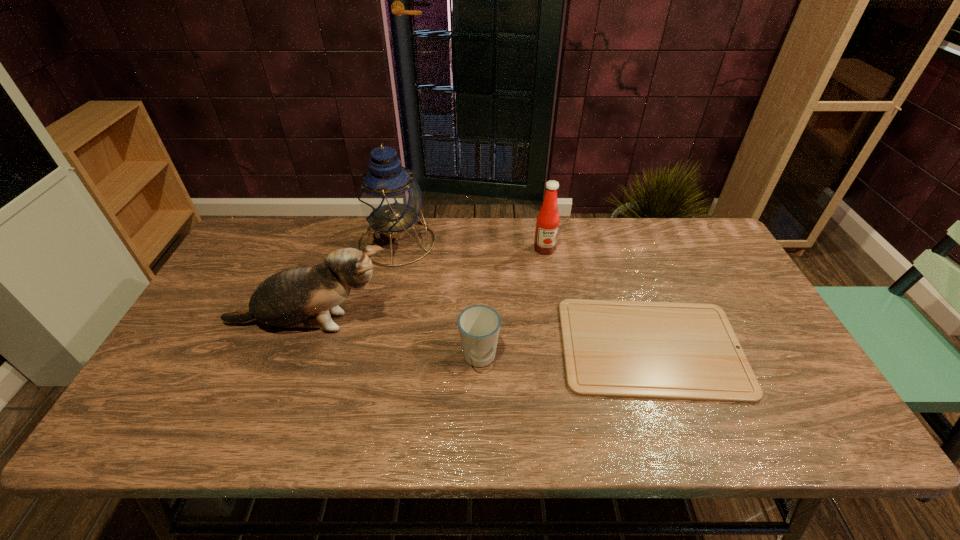
Where is `blank space that satisfies the following two spatial constraints: 1. on the front-facing side of the condiment; 2. on the right side of the shortest object`? Image resolution: width=960 pixels, height=540 pixels. blank space that satisfies the following two spatial constraints: 1. on the front-facing side of the condiment; 2. on the right side of the shortest object is located at coordinates (561, 347).

Where is `vacant area in the image that satisfies the following two spatial constraints: 1. on the front-facing side of the lantern; 2. on the right side of the chopping board`? vacant area in the image that satisfies the following two spatial constraints: 1. on the front-facing side of the lantern; 2. on the right side of the chopping board is located at coordinates (374, 347).

This screenshot has height=540, width=960. I want to click on vacant region that satisfies the following two spatial constraints: 1. at the face of the chopping board; 2. on the left side of the cat, so click(x=300, y=347).